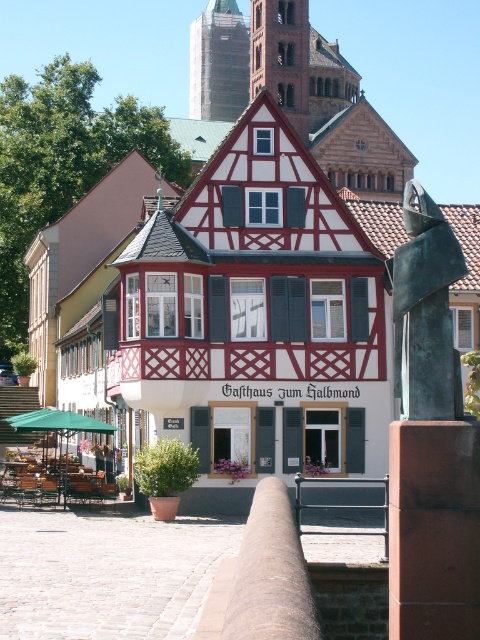
You are standing in front of the Gasthaus Zum Halbmond and want to take a photo of the bronze sculpture at right. If your camera can focus on objects up to 20 meters away, will you need to move closer to get a clear shot?

The bronze sculpture at right is 21.14 meters away from the viewer. Since your camera can only focus up to 20 meters, you need to move closer to ensure the sculpture is within the camera range.

You are standing in the plaza in front of the Gasthaus Zum Halbmond. You see the brown stone tower at upper center and the metallic gray rail at center. Which object is positioned to the left when viewed from your perspective?

The brown stone tower at upper center is to the left of the metallic gray rail at center, so the brown stone tower at upper center is positioned to the left.